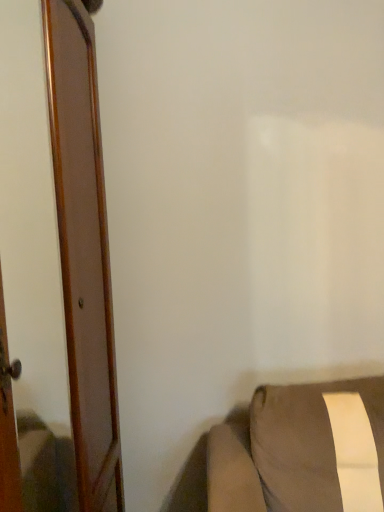
Question: Is wooden door at left in front of brown fabric cushion at lower right?

Choices:
 (A) no
 (B) yes

Answer: (B)

Question: Is wooden door at left directly adjacent to brown fabric cushion at lower right?

Choices:
 (A) yes
 (B) no

Answer: (B)

Question: Is wooden door at left to the right of brown fabric cushion at lower right from the viewer's perspective?

Choices:
 (A) yes
 (B) no

Answer: (B)

Question: Can you confirm if wooden door at left is thinner than brown fabric cushion at lower right?

Choices:
 (A) yes
 (B) no

Answer: (A)

Question: Considering the relative sizes of wooden door at left and brown fabric cushion at lower right in the image provided, is wooden door at left taller than brown fabric cushion at lower right?

Choices:
 (A) no
 (B) yes

Answer: (B)

Question: Is wooden door at left facing towards brown fabric cushion at lower right?

Choices:
 (A) no
 (B) yes

Answer: (B)

Question: Is brown fabric cushion at lower right wider than wooden door at left?

Choices:
 (A) no
 (B) yes

Answer: (B)

Question: Considering the relative sizes of brown fabric cushion at lower right and wooden door at left in the image provided, is brown fabric cushion at lower right thinner than wooden door at left?

Choices:
 (A) no
 (B) yes

Answer: (A)

Question: Is brown fabric cushion at lower right behind wooden door at left?

Choices:
 (A) no
 (B) yes

Answer: (B)

Question: Is brown fabric cushion at lower right positioned beyond the bounds of wooden door at left?

Choices:
 (A) yes
 (B) no

Answer: (A)

Question: From a real-world perspective, is brown fabric cushion at lower right on wooden door at left?

Choices:
 (A) yes
 (B) no

Answer: (B)

Question: Could you tell me if brown fabric cushion at lower right is turned towards wooden door at left?

Choices:
 (A) no
 (B) yes

Answer: (A)

Question: Is point (246, 460) closer or farther from the camera than point (104, 217)?

Choices:
 (A) farther
 (B) closer

Answer: (B)